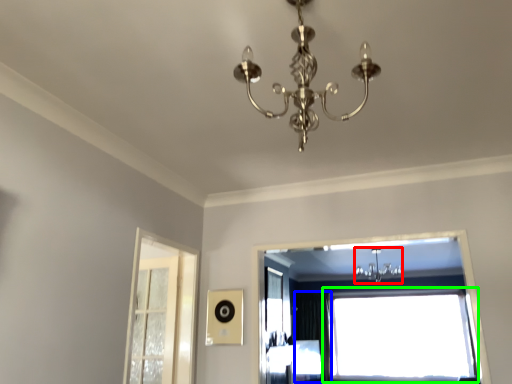
Question: Which object is the farthest from light fixture (highlighted by a red box)? Choose among these: curtain (highlighted by a blue box) or window (highlighted by a green box).

Choices:
 (A) curtain
 (B) window

Answer: (A)